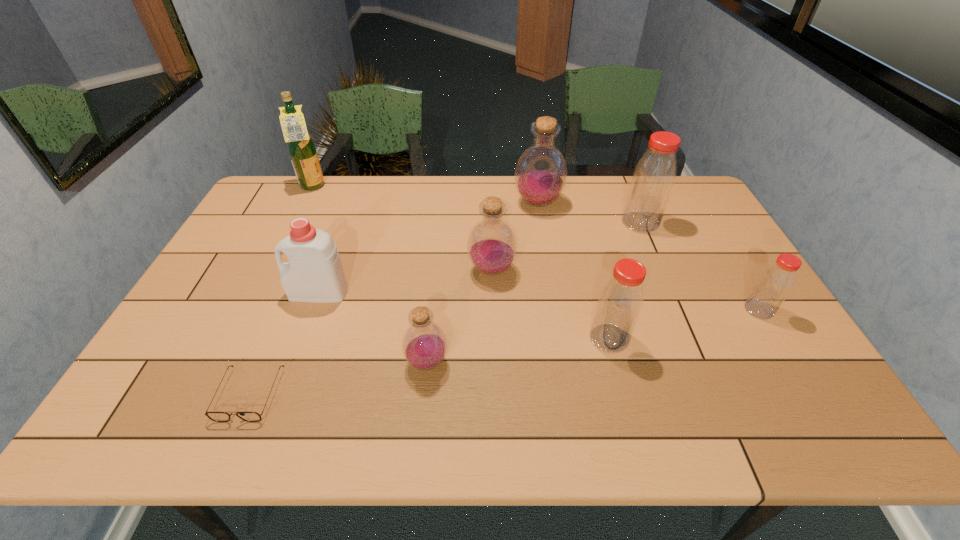
The width and height of the screenshot is (960, 540). I want to click on unoccupied area between the liquor and the rightmost red bottle, so click(536, 248).

This screenshot has width=960, height=540. Find the location of `vacant area between the liquor and the leftmost purple bottle`. vacant area between the liquor and the leftmost purple bottle is located at coordinates (370, 275).

You are a GUI agent. You are given a task and a screenshot of the screen. Output one action in this format:
    pyautogui.click(x=<x>, y=<y>)
    Task: Click on the object that is the seventh closest to the second nearest red bottle
    This screenshot has height=540, width=960.
    Given the screenshot: What is the action you would take?
    pyautogui.click(x=214, y=416)

Where is `object that stands as the eighth closest to the rightmost object`? object that stands as the eighth closest to the rightmost object is located at coordinates coord(302,151).

Point out which bottle is positioned as the third nearest to the nearest red bottle. Please provide its 2D coordinates. Your answer should be formatted as a tuple, i.e. [(x, y)], where the tuple contains the x and y coordinates of a point satisfying the conditions above.

[(424, 344)]

The width and height of the screenshot is (960, 540). Identify the location of the third closest bottle to the nearest red bottle. (424, 344).

Locate which purple bottle is the third closest to the white detergent. Please provide its 2D coordinates. Your answer should be formatted as a tuple, i.e. [(x, y)], where the tuple contains the x and y coordinates of a point satisfying the conditions above.

[(541, 172)]

The width and height of the screenshot is (960, 540). I want to click on purple bottle that is the third closest to the liquor, so click(x=424, y=344).

Locate an element on the screen. The height and width of the screenshot is (540, 960). red bottle object that ranks as the second closest to the liquor is located at coordinates (654, 176).

Find the location of `red bottle that is the closest to the detergent`. red bottle that is the closest to the detergent is located at coordinates (620, 302).